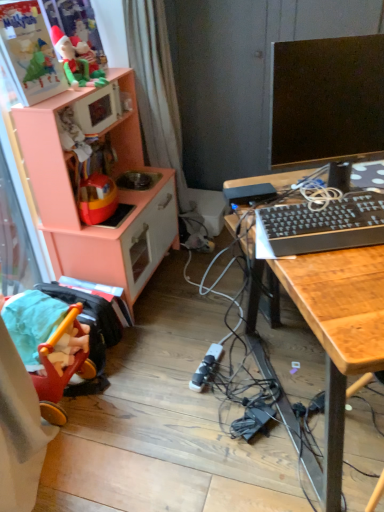
This screenshot has width=384, height=512. I want to click on vacant space situated on the left part of black plastic plug at center, so click(161, 369).